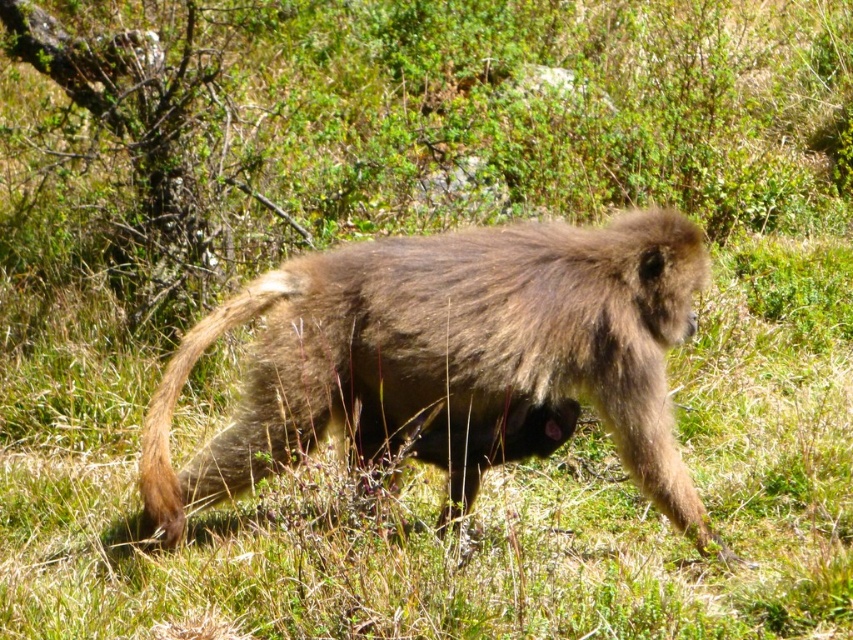
Which is more to the left, brown furry monkey at center or brown fuzzy tail at lower left?

From the viewer's perspective, brown fuzzy tail at lower left appears more on the left side.

Is point (405, 364) less distant than point (242, 304)?

Yes.

Between point (318, 333) and point (146, 442), which one is positioned in front?

Point (318, 333) is more forward.

Locate an element on the screen. brown furry monkey at center is located at coordinates (450, 356).